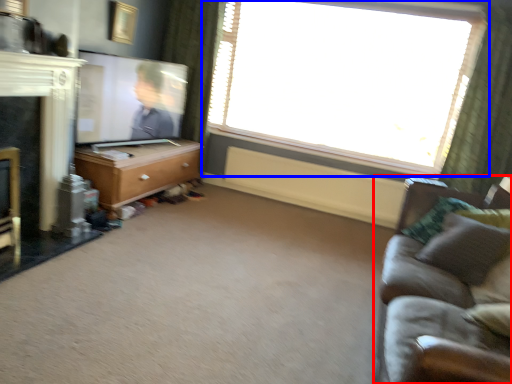
Question: Among these objects, which one is nearest to the camera, studio couch (highlighted by a red box) or window (highlighted by a blue box)?

Choices:
 (A) studio couch
 (B) window

Answer: (A)